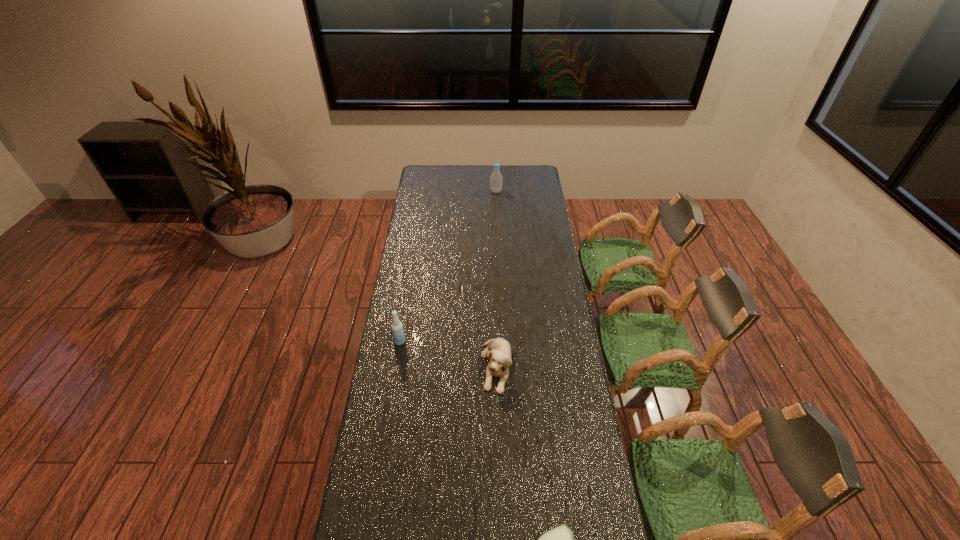
Locate an element on the screen. The height and width of the screenshot is (540, 960). the farthest bottle is located at coordinates (496, 179).

What are the coordinates of `the second nearest bottle` in the screenshot? It's located at (397, 328).

Find the location of a particular element. This screenshot has width=960, height=540. the leftmost bottle is located at coordinates (397, 328).

Identify the location of puppy. The width and height of the screenshot is (960, 540). point(498,351).

At what (x,y) coordinates should I click in order to perform the action: click on free space located on the left of the farthest bottle. Please return your answer as a coordinate pair (x, y). Looking at the image, I should click on (438, 191).

This screenshot has width=960, height=540. What are the coordinates of `free spot located on the back of the leftmost object` in the screenshot? It's located at (406, 303).

Identify the location of vacant space located 0.370m on the front-facing side of the puppy. (500, 501).

You are a GUI agent. You are given a task and a screenshot of the screen. Output one action in this format:
    pyautogui.click(x=<x>, y=<y>)
    Task: Click on the object that is at the left edge
    The height and width of the screenshot is (540, 960).
    Given the screenshot: What is the action you would take?
    pyautogui.click(x=397, y=328)

Locate an element on the screen. The height and width of the screenshot is (540, 960). blank space at the far edge of the desktop is located at coordinates (485, 177).

I want to click on vacant space at the left edge of the desktop, so click(x=425, y=252).